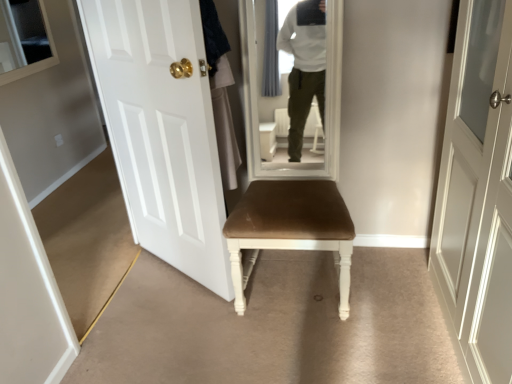
You are a GUI agent. You are given a task and a screenshot of the screen. Output one action in this format:
    pyautogui.click(x=<x>, y=<y>)
    Task: Click on the free spot to the left of brown velvet chair at center
    The height and width of the screenshot is (384, 512).
    Given the screenshot: What is the action you would take?
    coord(181,319)